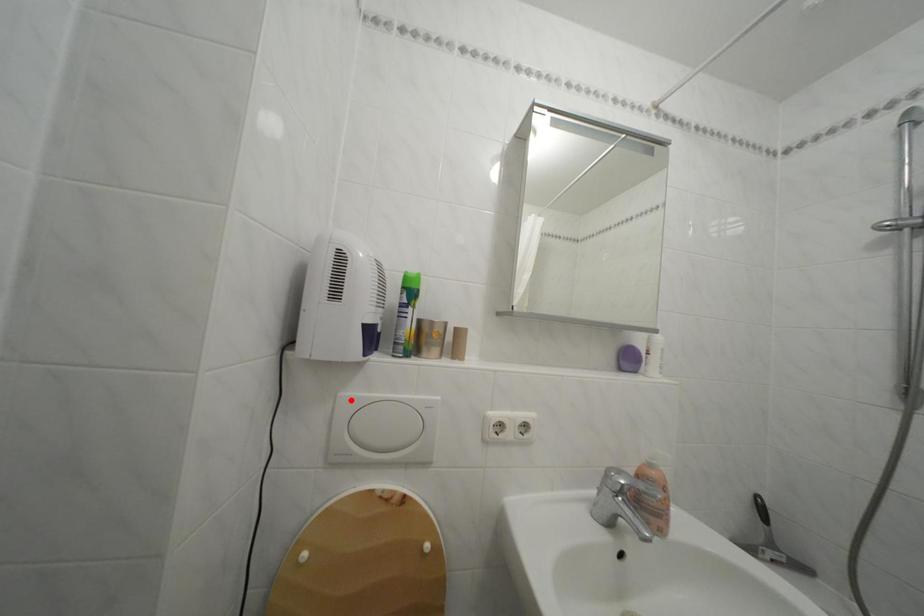
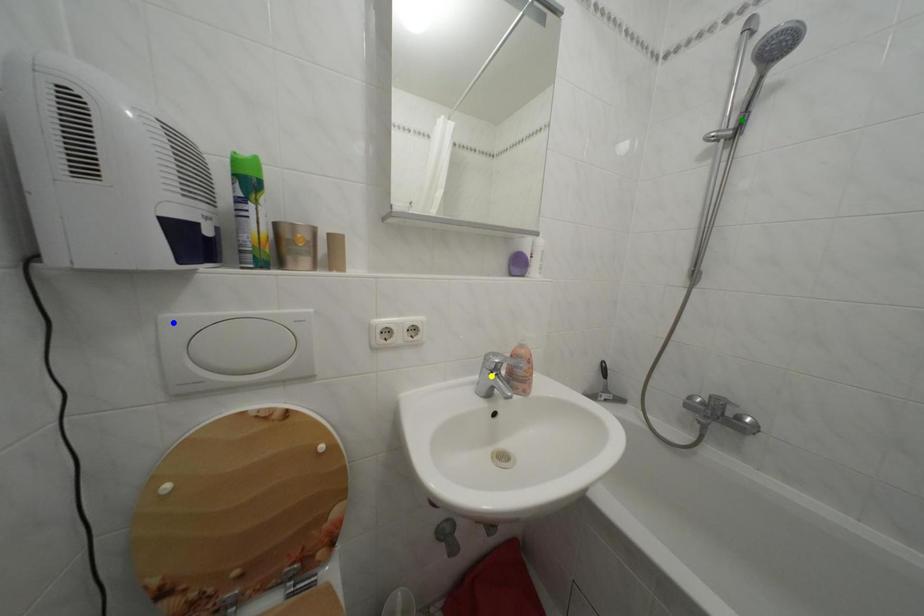
Question: I am providing you with two images of the same scene from different viewpoints. A red point is marked on the first image. You are given multiple points on the second image. Which mark in image 2 goes with the point in image 1?

Choices:
 (A) green point
 (B) blue point
 (C) yellow point

Answer: (B)